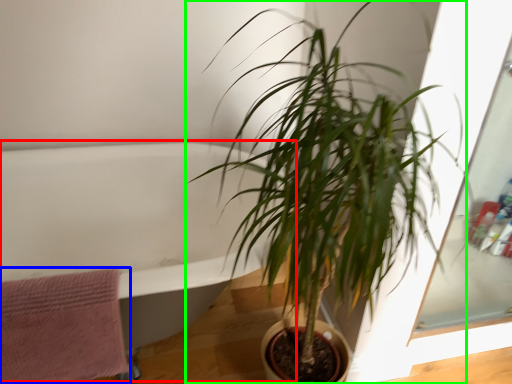
Question: Based on their relative distances, which object is farther from bath (highlighted by a red box)? Choose from bath towel (highlighted by a blue box) and houseplant (highlighted by a green box).

Choices:
 (A) bath towel
 (B) houseplant

Answer: (B)